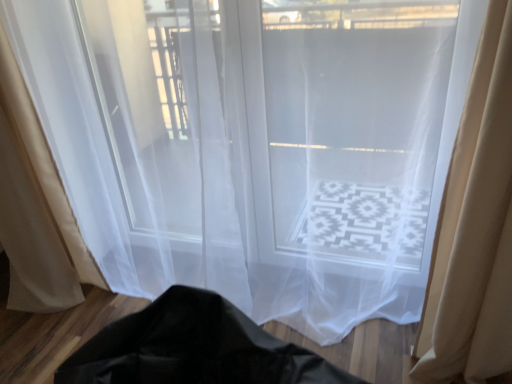
Question: Does beige sheer curtain at right, which is counted as the first curtain, starting from the right, have a smaller size compared to beige sheer curtain at left, positioned as the second curtain in right-to-left order?

Choices:
 (A) yes
 (B) no

Answer: (A)

Question: Is beige sheer curtain at right, which is counted as the first curtain, starting from the right, facing towards beige sheer curtain at left, positioned as the second curtain in right-to-left order?

Choices:
 (A) no
 (B) yes

Answer: (A)

Question: Is beige sheer curtain at right, the 2th curtain viewed from the left, in contact with beige sheer curtain at left, the first curtain positioned from the left?

Choices:
 (A) no
 (B) yes

Answer: (A)

Question: Can you confirm if beige sheer curtain at right, the 2th curtain viewed from the left, is shorter than beige sheer curtain at left, positioned as the second curtain in right-to-left order?

Choices:
 (A) no
 (B) yes

Answer: (B)

Question: Is beige sheer curtain at right, which is counted as the first curtain, starting from the right, not inside beige sheer curtain at left, positioned as the second curtain in right-to-left order?

Choices:
 (A) yes
 (B) no

Answer: (A)

Question: From a real-world perspective, is beige sheer curtain at right, the 2th curtain viewed from the left, beneath beige sheer curtain at left, positioned as the second curtain in right-to-left order?

Choices:
 (A) yes
 (B) no

Answer: (A)

Question: Can you confirm if beige sheer curtain at left, positioned as the second curtain in right-to-left order, is positioned to the right of beige sheer curtain at right, which is counted as the first curtain, starting from the right?

Choices:
 (A) no
 (B) yes

Answer: (A)

Question: Can you confirm if beige sheer curtain at left, positioned as the second curtain in right-to-left order, is smaller than beige sheer curtain at right, which is counted as the first curtain, starting from the right?

Choices:
 (A) yes
 (B) no

Answer: (B)

Question: From the image's perspective, is beige sheer curtain at left, positioned as the second curtain in right-to-left order, over beige sheer curtain at right, which is counted as the first curtain, starting from the right?

Choices:
 (A) no
 (B) yes

Answer: (B)

Question: Is beige sheer curtain at left, the first curtain positioned from the left, positioned with its back to beige sheer curtain at right, the 2th curtain viewed from the left?

Choices:
 (A) no
 (B) yes

Answer: (A)

Question: Is beige sheer curtain at left, the first curtain positioned from the left, beside beige sheer curtain at right, which is counted as the first curtain, starting from the right?

Choices:
 (A) no
 (B) yes

Answer: (A)

Question: From a real-world perspective, is beige sheer curtain at left, the first curtain positioned from the left, located beneath beige sheer curtain at right, the 2th curtain viewed from the left?

Choices:
 (A) no
 (B) yes

Answer: (A)

Question: Is point (53, 203) closer or farther from the camera than point (455, 188)?

Choices:
 (A) closer
 (B) farther

Answer: (B)